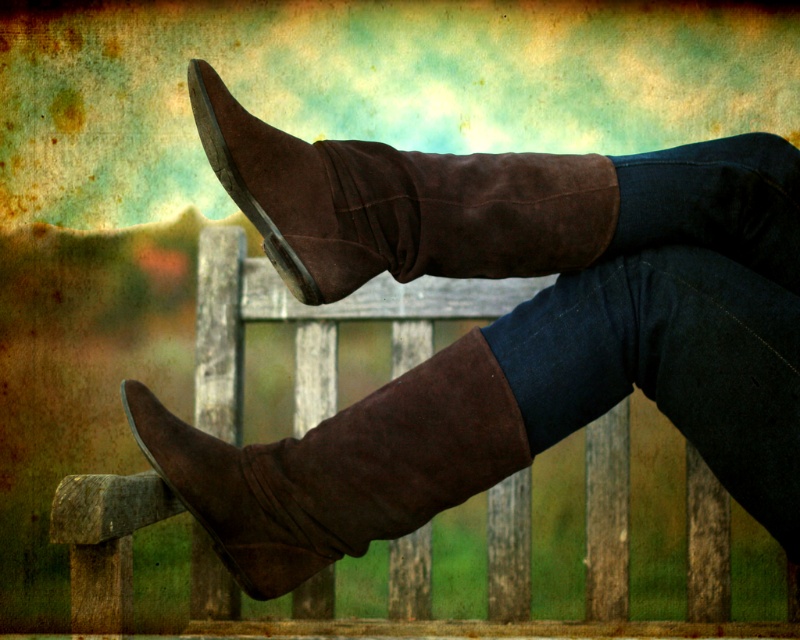
You are standing in a field and see the suede boot at center. If you walk 0.5 units to the right, will you be closer to the boot?

The suede boot at center is at point (400, 204). Moving 0.5 units to the right would take you to position (400, 524), which is further away from the boot. Therefore, you will not be closer to the boot.

You are trying to decide which boot to wear based on the image. Both the suede boot at center and the suede brown boot at center are options. Which one is larger?

The suede brown boot at center is larger than the suede boot at center.

You are standing in the scene and want to place a small pebble exactly where the suede boots at center are located. Is this possible?

The suede boots at center are located at point coordinates of (504, 326), so yes, you can place the pebble there as long as you position it precisely at those coordinates.